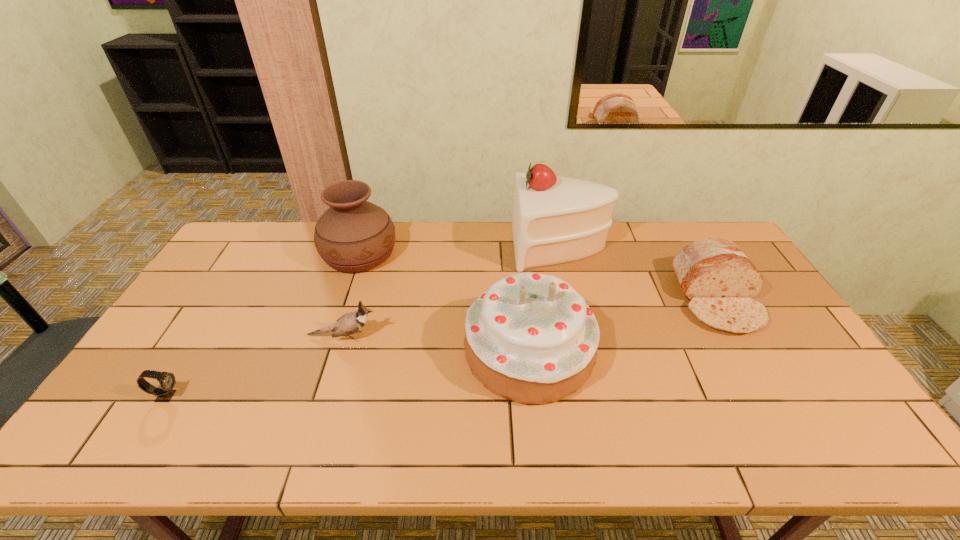
The height and width of the screenshot is (540, 960). I want to click on free spot at the left edge of the desktop, so click(x=153, y=354).

At what (x,y) coordinates should I click in order to perform the action: click on vacant space at the right edge of the desktop. Please return your answer as a coordinate pair (x, y). This screenshot has width=960, height=540. Looking at the image, I should click on (795, 354).

At what (x,y) coordinates should I click in order to perform the action: click on vacant space at the far left corner. Please return your answer as a coordinate pair (x, y). This screenshot has height=540, width=960. Looking at the image, I should click on (232, 254).

Find the location of a particular element. This screenshot has width=960, height=540. free space at the near left corner is located at coordinates (104, 451).

Identify the location of vacant space at the far right corner of the desktop. (692, 227).

Locate an element on the screen. free space between the watch and the bird is located at coordinates (254, 366).

Where is `free point between the shorter cake and the shortest object`? free point between the shorter cake and the shortest object is located at coordinates (348, 373).

Locate an element on the screen. The height and width of the screenshot is (540, 960). vacant point located between the shortest object and the bird is located at coordinates (254, 366).

Identify the location of free spot between the urn and the watch. The width and height of the screenshot is (960, 540). (263, 325).

Locate an element on the screen. vacant region between the tallest object and the urn is located at coordinates (460, 251).